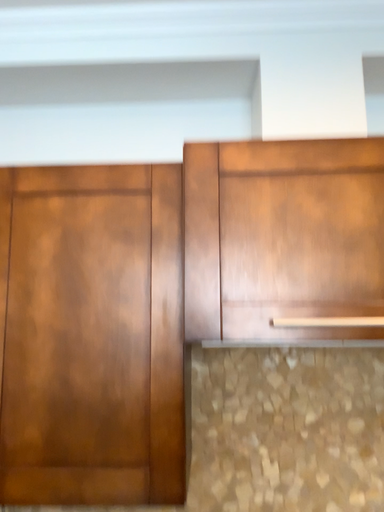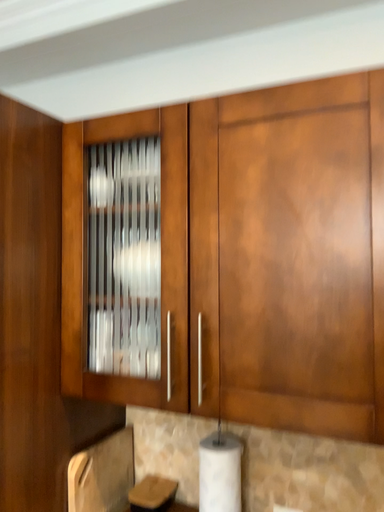
Question: How did the camera likely rotate when shooting the video?

Choices:
 (A) rotated right
 (B) rotated left

Answer: (B)